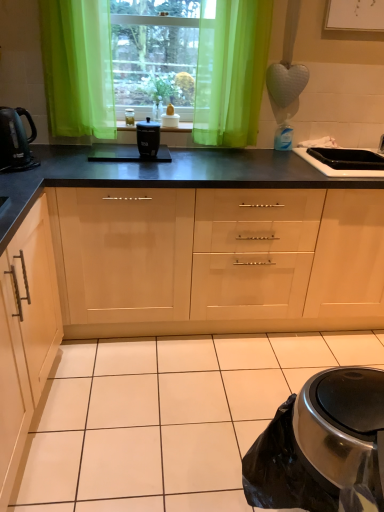
Question: Is black matte slow cooker at center oriented away from shiny black kettle at left?

Choices:
 (A) yes
 (B) no

Answer: (B)

Question: Is black matte slow cooker at center to the left of shiny black kettle at left from the viewer's perspective?

Choices:
 (A) yes
 (B) no

Answer: (B)

Question: From a real-world perspective, is black matte slow cooker at center under shiny black kettle at left?

Choices:
 (A) no
 (B) yes

Answer: (B)

Question: Does black matte slow cooker at center have a greater height compared to shiny black kettle at left?

Choices:
 (A) no
 (B) yes

Answer: (A)

Question: Is black matte slow cooker at center not inside shiny black kettle at left?

Choices:
 (A) no
 (B) yes

Answer: (B)

Question: Would you say black glossy sink at right is to the left or to the right of matte wood cabinets at center, which ranks as the 2th cabinetry in left-to-right order, in the picture?

Choices:
 (A) right
 (B) left

Answer: (A)

Question: Considering the positions of black glossy sink at right and matte wood cabinets at center, which ranks as the 2th cabinetry in left-to-right order, in the image, is black glossy sink at right bigger or smaller than matte wood cabinets at center, which ranks as the 2th cabinetry in left-to-right order,?

Choices:
 (A) big
 (B) small

Answer: (B)

Question: Is black glossy sink at right wider or thinner than matte wood cabinets at center, the 1th cabinetry positioned from the right?

Choices:
 (A) thin
 (B) wide

Answer: (A)

Question: Is black glossy sink at right taller or shorter than matte wood cabinets at center, which ranks as the 2th cabinetry in left-to-right order?

Choices:
 (A) tall
 (B) short

Answer: (B)

Question: Is point (321, 162) positioned closer to the camera than point (163, 130)?

Choices:
 (A) farther
 (B) closer

Answer: (B)

Question: Is black glossy sink at right to the left or to the right of black plastic container at center in the image?

Choices:
 (A) right
 (B) left

Answer: (A)

Question: Considering their positions, is black glossy sink at right located in front of or behind black plastic container at center?

Choices:
 (A) front
 (B) behind

Answer: (A)

Question: Is black glossy sink at right inside or outside of black plastic container at center?

Choices:
 (A) outside
 (B) inside

Answer: (A)

Question: In terms of width, does black matte slow cooker at center look wider or thinner when compared to light wood/finish cabinet at left, which appears as the 1th cabinetry when viewed from the left?

Choices:
 (A) thin
 (B) wide

Answer: (A)

Question: Would you say black matte slow cooker at center is to the left or to the right of light wood/finish cabinet at left, which appears as the 1th cabinetry when viewed from the left, in the picture?

Choices:
 (A) right
 (B) left

Answer: (A)